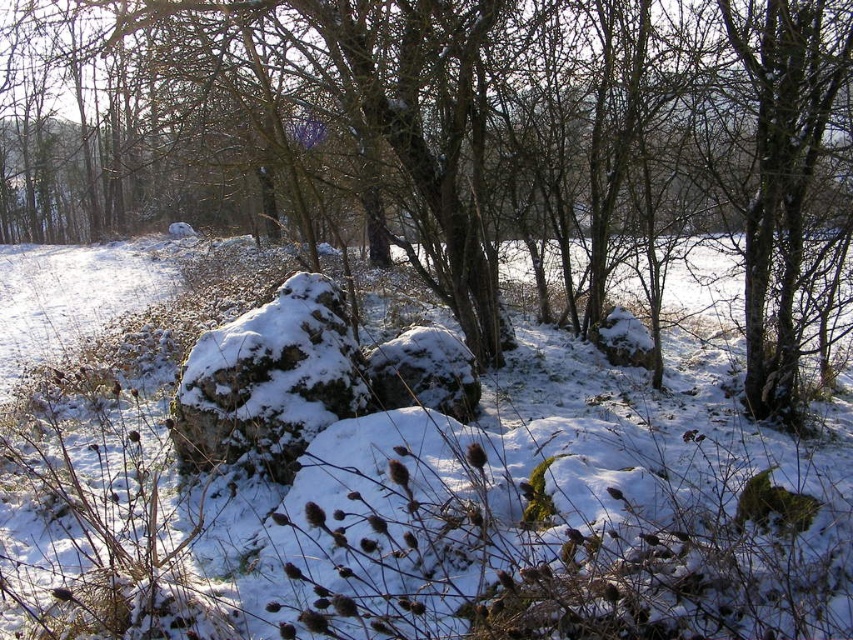
Who is more forward, (494, 246) or (776, 611)?

Point (776, 611) is more forward.

Is brown rough tree at center further to the viewer compared to white fluffy snow at center?

Yes, it is.

Between point (701, 128) and point (88, 294), which one is positioned behind?

The point (88, 294) is more distant.

Identify the location of brown rough tree at center. coord(456,141).